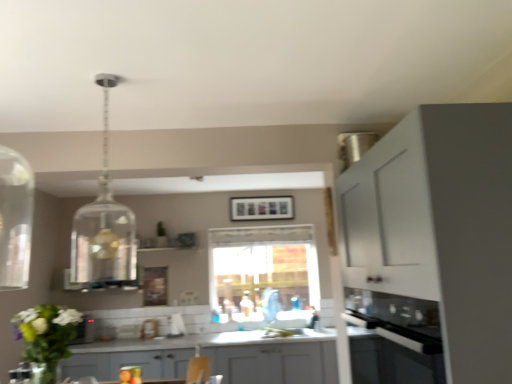
Question: Would you say white matte cabinet at right, which is counted as the second cabinetry, starting from the bottom, is part of gray matte cabinet at center, which is the second cabinetry in front-to-back order,'s contents?

Choices:
 (A) yes
 (B) no

Answer: (B)

Question: Is gray matte cabinet at center, which is the second cabinetry in front-to-back order, outside white matte cabinet at right, which is the 1th cabinetry in top-to-bottom order?

Choices:
 (A) yes
 (B) no

Answer: (A)

Question: Can you confirm if gray matte cabinet at center, which appears as the 1th cabinetry when ordered from the bottom, is wider than white matte cabinet at right, the 1th cabinetry when ordered from front to back?

Choices:
 (A) yes
 (B) no

Answer: (A)

Question: Can you confirm if gray matte cabinet at center, which is the second cabinetry in front-to-back order, is taller than white matte cabinet at right, which is the 1th cabinetry in top-to-bottom order?

Choices:
 (A) no
 (B) yes

Answer: (A)

Question: Is gray matte cabinet at center, which ranks as the first cabinetry in back-to-front order, oriented towards white matte cabinet at right, arranged as the second cabinetry when viewed from the back?

Choices:
 (A) yes
 (B) no

Answer: (B)

Question: From a real-world perspective, is gray matte cabinet at center, which appears as the 1th cabinetry when ordered from the bottom, positioned under white matte cabinet at right, arranged as the second cabinetry when viewed from the back, based on gravity?

Choices:
 (A) no
 (B) yes

Answer: (B)

Question: Does translucent glass bottle at center have a greater width compared to gray matte cabinet at center, which ranks as the first cabinetry in back-to-front order?

Choices:
 (A) no
 (B) yes

Answer: (A)

Question: Is gray matte cabinet at center, which is the 2th cabinetry from top to bottom, completely or partially inside translucent glass bottle at center?

Choices:
 (A) no
 (B) yes

Answer: (A)

Question: From the image's perspective, is translucent glass bottle at center below gray matte cabinet at center, which is the 2th cabinetry from top to bottom?

Choices:
 (A) yes
 (B) no

Answer: (B)

Question: Is translucent glass bottle at center oriented towards gray matte cabinet at center, which ranks as the first cabinetry in back-to-front order?

Choices:
 (A) no
 (B) yes

Answer: (A)

Question: Is translucent glass bottle at center not inside gray matte cabinet at center, which ranks as the first cabinetry in back-to-front order?

Choices:
 (A) no
 (B) yes

Answer: (B)

Question: Is translucent glass bottle at center at the right side of gray matte cabinet at center, which is the second cabinetry in front-to-back order?

Choices:
 (A) no
 (B) yes

Answer: (B)

Question: Does white matte cabinet at right, the 1th cabinetry when ordered from front to back, lie behind translucent glass bottle at center?

Choices:
 (A) yes
 (B) no

Answer: (B)